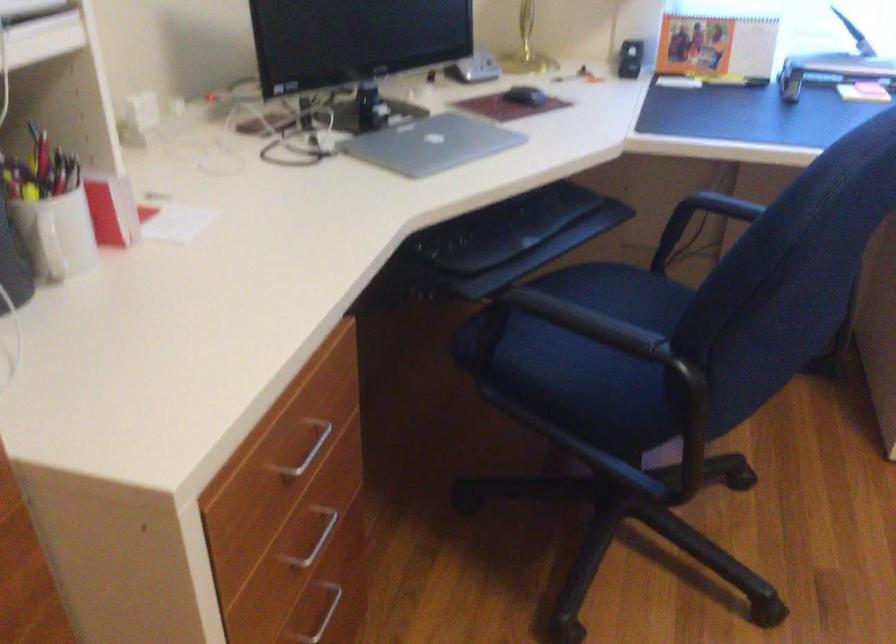
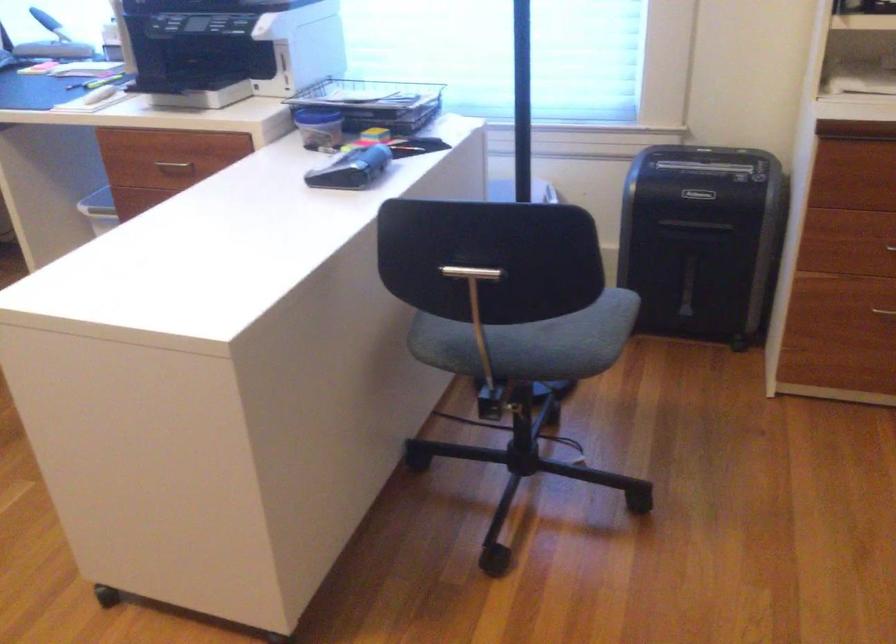
Question: What movement of the cameraman would produce the second image?

Choices:
 (A) Left
 (B) Right
 (C) Forward
 (D) Backward

Answer: (B)